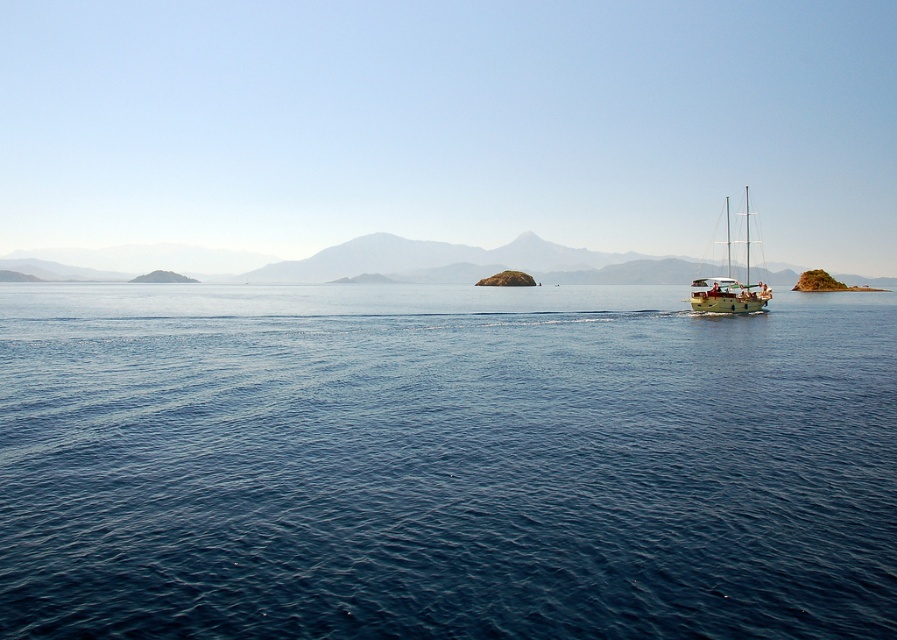
Who is positioned more to the left, blue water at center or rocky brown mountain at center?

From the viewer's perspective, rocky brown mountain at center appears more on the left side.

Is point (300, 602) positioned before point (504, 244)?

Yes, it is.

Identify the location of blue water at center. Image resolution: width=897 pixels, height=640 pixels. (443, 464).

The width and height of the screenshot is (897, 640). Identify the location of blue water at center. (443, 464).

Is blue water at center taller than wooden sailboat at right?

In fact, blue water at center may be shorter than wooden sailboat at right.

What do you see at coordinates (443, 464) in the screenshot?
I see `blue water at center` at bounding box center [443, 464].

At what (x,y) coordinates should I click in order to perform the action: click on blue water at center. Please return your answer as a coordinate pair (x, y). The width and height of the screenshot is (897, 640). Looking at the image, I should click on (443, 464).

Who is lower down, rocky brown mountain at center or wooden sailboat at right?

rocky brown mountain at center

Is rocky brown mountain at center below wooden sailboat at right?

Indeed, rocky brown mountain at center is positioned under wooden sailboat at right.

Identify the location of rocky brown mountain at center. (338, 260).